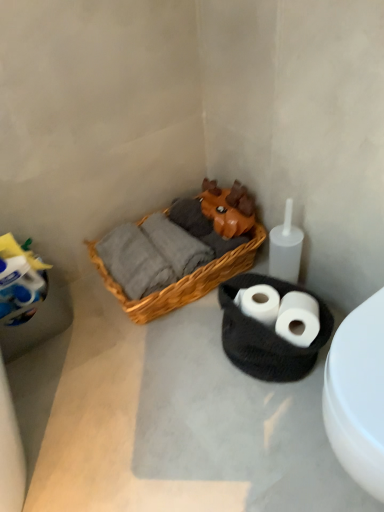
This screenshot has height=512, width=384. In order to click on vacant region above woven basket at center (from a real-world perspective) in this screenshot , I will do `click(159, 393)`.